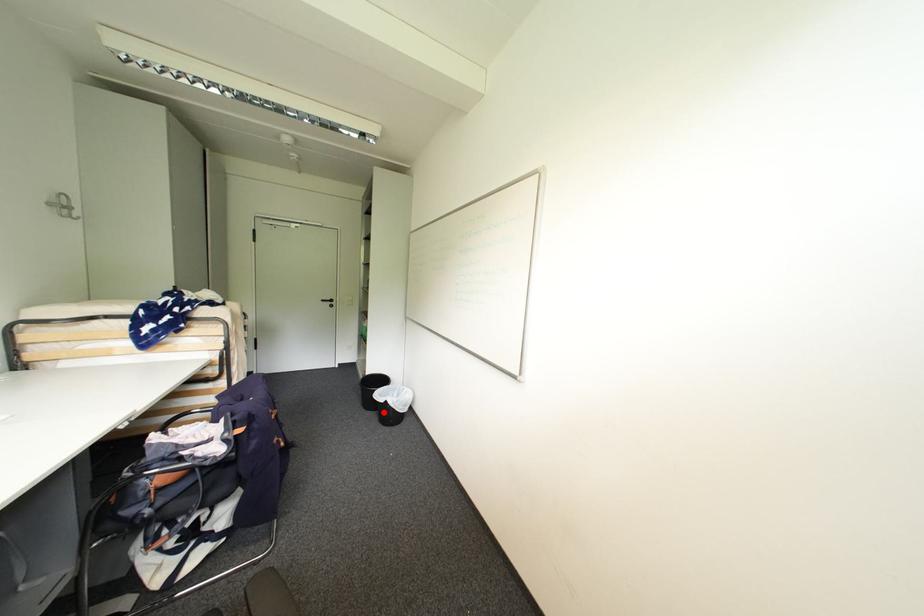
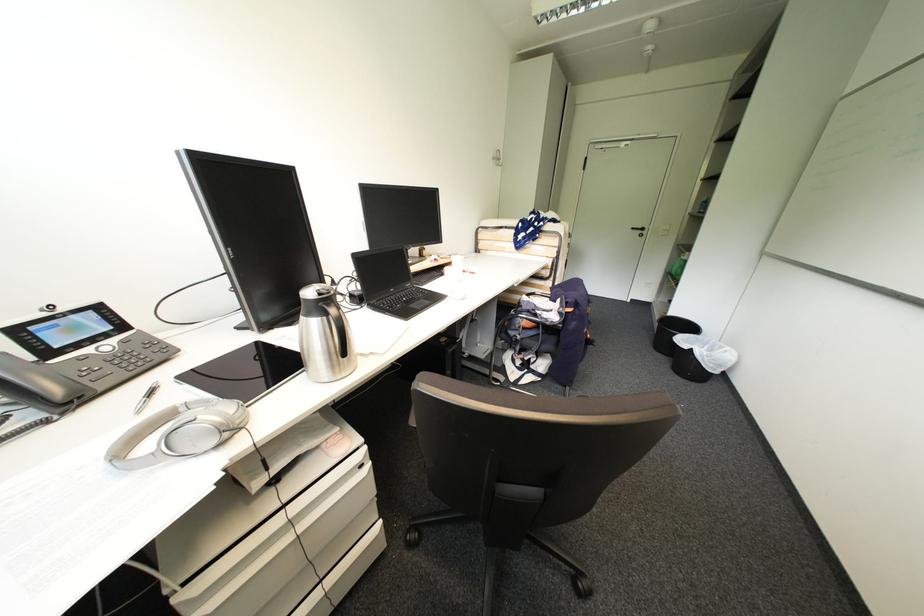
Find the pixel in the second image that matches the highlighted location in the first image.

(677, 359)